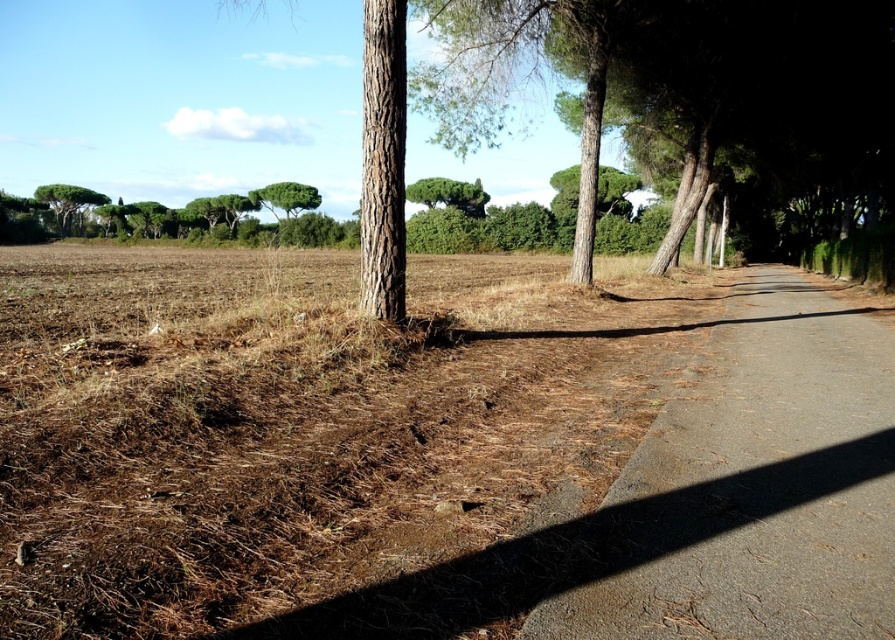
You are standing on the paved pathway and want to determine which tree is more slender between the green leafy tree at center and the green leafy tree at upper left. Which one is thinner?

Result: The green leafy tree at center is thinner than the green leafy tree at upper left.

You are standing on the pathway and want to reach a point exactly 4 meters away from you. Is the point at coordinates point (x=466, y=380) within your target range?

The point at coordinates point (x=466, y=380) is 3.92 meters from the viewer, which is within the 4 meter target range.